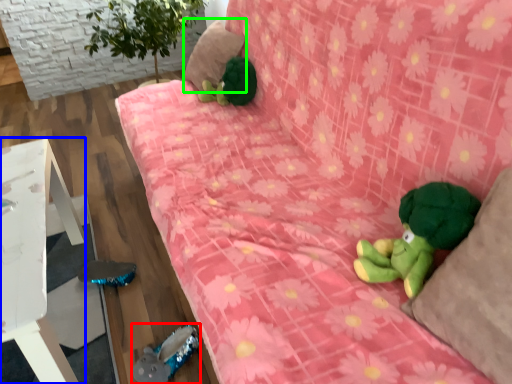
Question: Which is farther away from toy (highlighted by a red box)? furniture (highlighted by a blue box) or pillow (highlighted by a green box)?

Choices:
 (A) furniture
 (B) pillow

Answer: (B)